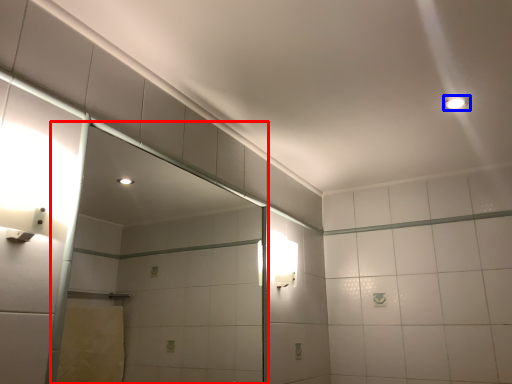
Question: Which of the following is the closest to the observer, glass door (highlighted by a red box) or light fixture (highlighted by a blue box)?

Choices:
 (A) glass door
 (B) light fixture

Answer: (A)